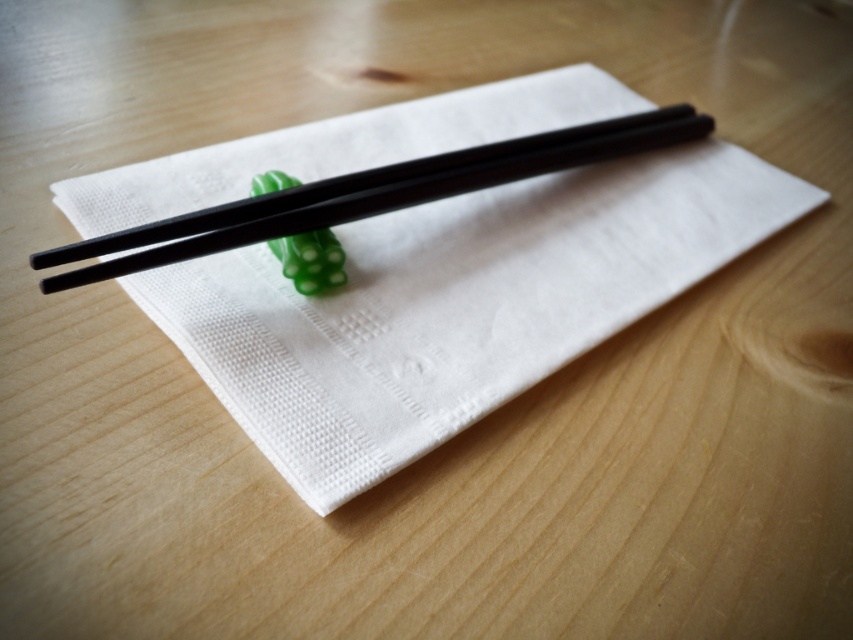
Question: Is black glossy chopsticks at center to the left of green rubbery toy at center from the viewer's perspective?

Choices:
 (A) yes
 (B) no

Answer: (B)

Question: Does black glossy chopsticks at center have a lesser width compared to green rubbery toy at center?

Choices:
 (A) yes
 (B) no

Answer: (B)

Question: Which object is closer to the camera taking this photo?

Choices:
 (A) green rubbery toy at center
 (B) black glossy chopsticks at center

Answer: (B)

Question: Does black glossy chopsticks at center appear on the left side of green rubbery toy at center?

Choices:
 (A) no
 (B) yes

Answer: (A)